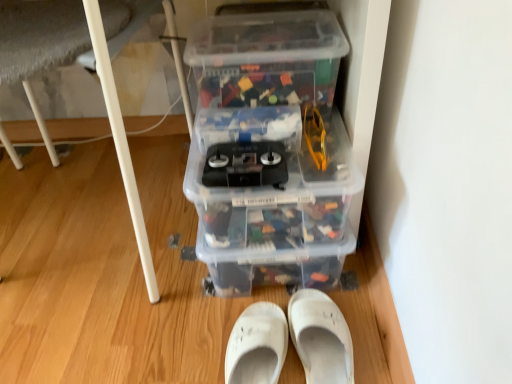
Where is `vacant area on top of transparent plastic storage box at center, placed as the 2th storage box when sorted from top to bottom (from a real-world perspective)`? vacant area on top of transparent plastic storage box at center, placed as the 2th storage box when sorted from top to bottom (from a real-world perspective) is located at coordinates click(x=262, y=109).